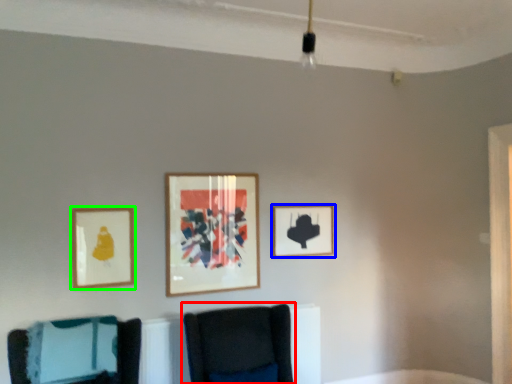
Question: Estimate the real-world distances between objects in this image. Which object is closer to furniture (highlighted by a red box), picture frame (highlighted by a blue box) or picture frame (highlighted by a green box)?

Choices:
 (A) picture frame
 (B) picture frame

Answer: (A)